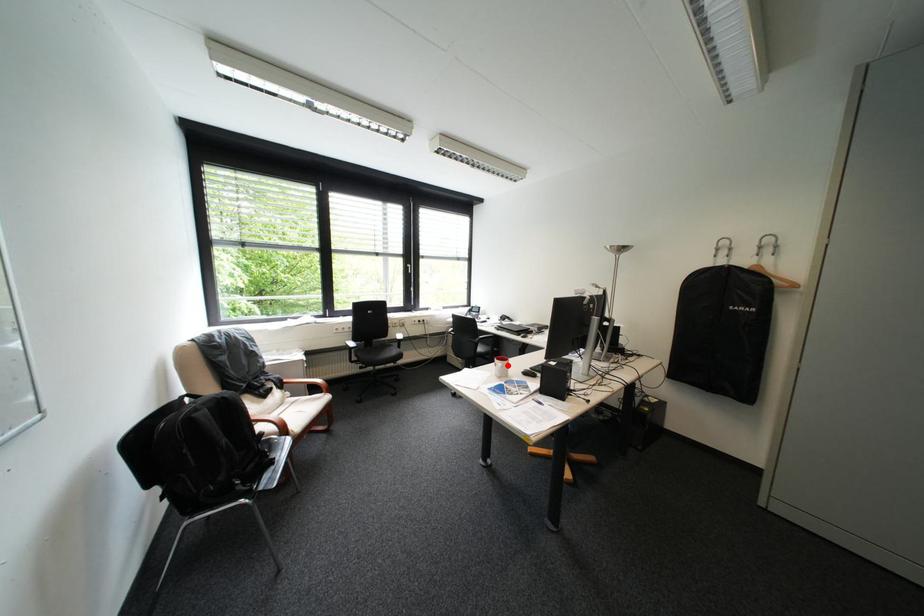
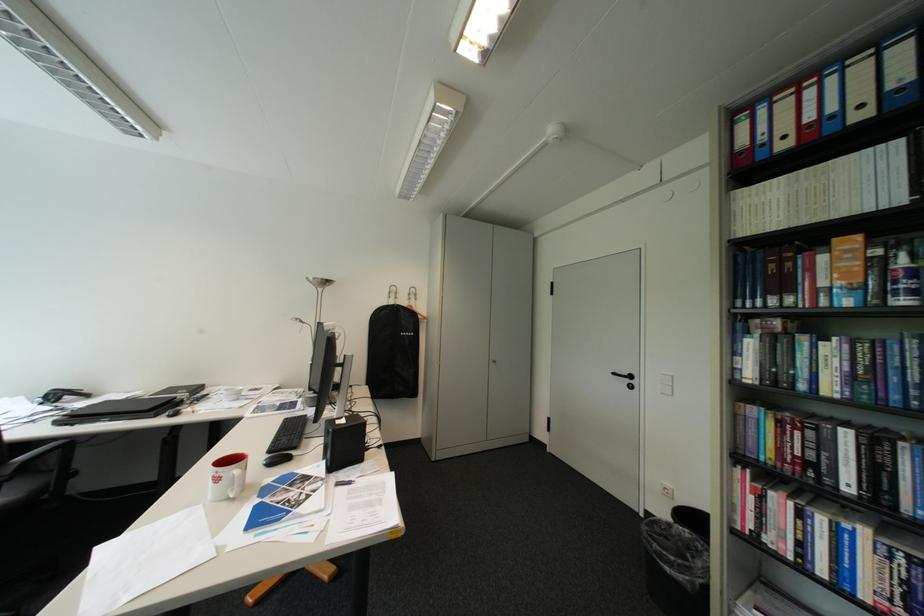
Question: I am providing you with two images of the same scene from different viewpoints. A red point is shown in image1. For the corresponding object point in image2, is it positioned nearer or farther from the camera?

Choices:
 (A) Nearer
 (B) Farther

Answer: (B)